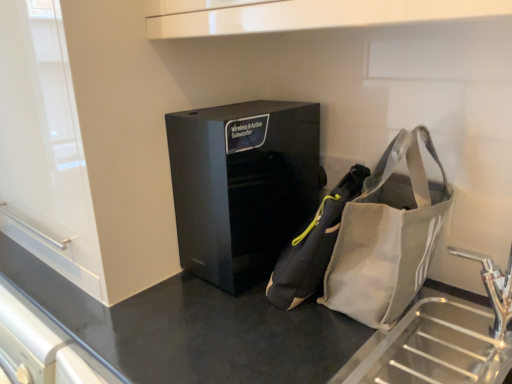
Question: Does gray fabric pouch at center have a larger size compared to black glossy speaker at center?

Choices:
 (A) yes
 (B) no

Answer: (B)

Question: Is the depth of gray fabric pouch at center greater than that of black glossy speaker at center?

Choices:
 (A) no
 (B) yes

Answer: (A)

Question: Does gray fabric pouch at center have a greater width compared to black glossy speaker at center?

Choices:
 (A) yes
 (B) no

Answer: (B)

Question: Is gray fabric pouch at center not close to black glossy speaker at center?

Choices:
 (A) no
 (B) yes

Answer: (A)

Question: Is gray fabric pouch at center oriented towards black glossy speaker at center?

Choices:
 (A) yes
 (B) no

Answer: (A)

Question: Is the position of gray fabric pouch at center less distant than that of black glossy speaker at center?

Choices:
 (A) yes
 (B) no

Answer: (A)

Question: Does gray fabric pouch at center turn towards black matte counter at center?

Choices:
 (A) yes
 (B) no

Answer: (B)

Question: From a real-world perspective, is gray fabric pouch at center below black matte counter at center?

Choices:
 (A) no
 (B) yes

Answer: (A)

Question: Can you confirm if gray fabric pouch at center is smaller than black matte counter at center?

Choices:
 (A) no
 (B) yes

Answer: (B)

Question: Considering the relative positions of gray fabric pouch at center and black matte counter at center in the image provided, is gray fabric pouch at center to the right of black matte counter at center from the viewer's perspective?

Choices:
 (A) no
 (B) yes

Answer: (B)

Question: Is gray fabric pouch at center far away from black matte counter at center?

Choices:
 (A) no
 (B) yes

Answer: (A)

Question: From a real-world perspective, is gray fabric pouch at center located higher than black matte counter at center?

Choices:
 (A) yes
 (B) no

Answer: (A)

Question: Does black matte counter at center have a lesser width compared to black glossy speaker at center?

Choices:
 (A) yes
 (B) no

Answer: (B)